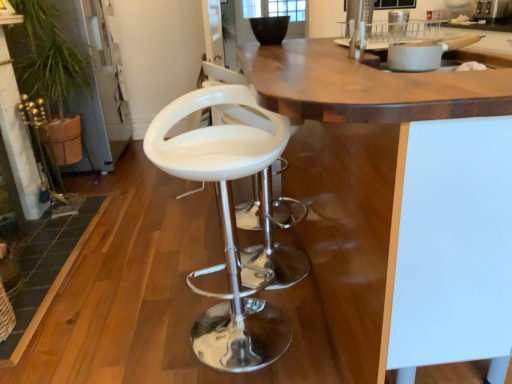
In order to click on white glossy bar stool at center in this screenshot , I will do `click(227, 224)`.

The image size is (512, 384). What do you see at coordinates (227, 224) in the screenshot? I see `white glossy bar stool at center` at bounding box center [227, 224].

In the scene shown: Measure the distance between white ceramic pot at upper right and camera.

The distance of white ceramic pot at upper right from camera is 3.70 feet.

Where is `wooden at center`? The height and width of the screenshot is (384, 512). wooden at center is located at coordinates (396, 169).

Measure the distance between white ceramic pot at upper right and white glossy bar stool at center.

white ceramic pot at upper right is 30.81 inches away from white glossy bar stool at center.

Considering the sizes of objects white ceramic pot at upper right and white glossy bar stool at center in the image provided, who is taller, white ceramic pot at upper right or white glossy bar stool at center?

white glossy bar stool at center.

From a real-world perspective, is white ceramic pot at upper right positioned over white glossy bar stool at center based on gravity?

Yes, from a real-world perspective, white ceramic pot at upper right is above white glossy bar stool at center.

In the image, is white ceramic pot at upper right on the left side or the right side of white glossy bar stool at center?

white ceramic pot at upper right is positioned on white glossy bar stool at center's right side.

Looking at this image, can white glossy bar stool at center be found inside wooden at center?

That's correct, white glossy bar stool at center is inside wooden at center.

Considering the sizes of objects wooden at center and white glossy bar stool at center in the image provided, who is smaller, wooden at center or white glossy bar stool at center?

white glossy bar stool at center.

From the image's perspective, is wooden at center located above or below white glossy bar stool at center?

From the image's perspective, wooden at center appears above white glossy bar stool at center.

Which object is further away from the camera taking this photo, wooden at center or white glossy bar stool at center?

white glossy bar stool at center is further away from the camera.

Can you tell me how much white glossy bar stool at center and wooden at center differ in facing direction?

They differ by 94.2 degrees in their facing directions.

From the image's perspective, which object appears higher, white glossy bar stool at center or wooden at center?

wooden at center.

Which is closer, (281,330) or (490,166)?

Point (490,166)

Which of these two, white glossy bar stool at center or wooden at center, stands taller?

wooden at center is taller.

From the image's perspective, would you say wooden at center is shown under white ceramic pot at upper right?

Yes, from the image's perspective, wooden at center is below white ceramic pot at upper right.

Which of these two, wooden at center or white ceramic pot at upper right, is wider?

wooden at center.

Can you confirm if wooden at center is smaller than white ceramic pot at upper right?

Incorrect, wooden at center is not smaller in size than white ceramic pot at upper right.

In the scene shown: How many degrees apart are the facing directions of white glossy bar stool at center and white ceramic pot at upper right?

white glossy bar stool at center and white ceramic pot at upper right are facing 90 degrees away from each other.

Considering the sizes of objects white glossy bar stool at center and white ceramic pot at upper right in the image provided, who is taller, white glossy bar stool at center or white ceramic pot at upper right?

Standing taller between the two is white glossy bar stool at center.

From the image's perspective, is white glossy bar stool at center on white ceramic pot at upper right?

No, from the image's perspective, white glossy bar stool at center is not above white ceramic pot at upper right.

From a real-world perspective, is white glossy bar stool at center under white ceramic pot at upper right?

Yes, from a real-world perspective, white glossy bar stool at center is beneath white ceramic pot at upper right.

From a real-world perspective, which object rests below the other?

From a 3D spatial view, wooden at center is below.

Between white ceramic pot at upper right and wooden at center, which one has more height?

With more height is wooden at center.

Considering the sizes of objects white ceramic pot at upper right and wooden at center in the image provided, who is bigger, white ceramic pot at upper right or wooden at center?

Bigger between the two is wooden at center.

Can we say white ceramic pot at upper right lies outside wooden at center?

No.

Find the location of a particular element. The width and height of the screenshot is (512, 384). chair in front of the white ceramic pot at upper right is located at coordinates (227, 224).

You are a GUI agent. You are given a task and a screenshot of the screen. Output one action in this format:
    pyautogui.click(x=<x>, y=<y>)
    Task: Click on the countertop that is on the right side of white glossy bar stool at center
    
    Given the screenshot: What is the action you would take?
    pyautogui.click(x=396, y=169)

Estimate the real-world distances between objects in this image. Which object is further from white glossy bar stool at center, wooden at center or white ceramic pot at upper right?

white ceramic pot at upper right.

Based on their spatial positions, is white glossy bar stool at center or wooden at center further from white ceramic pot at upper right?

Among the two, white glossy bar stool at center is located further to white ceramic pot at upper right.

Based on their spatial positions, is white ceramic pot at upper right or white glossy bar stool at center further from wooden at center?

white glossy bar stool at center is positioned further to the anchor wooden at center.

Looking at the image, which one is located closer to white ceramic pot at upper right, wooden at center or white glossy bar stool at center?

wooden at center.

Based on their spatial positions, is white glossy bar stool at center or white ceramic pot at upper right closer to wooden at center?

Based on the image, white ceramic pot at upper right appears to be nearer to wooden at center.

Based on their spatial positions, is white ceramic pot at upper right or wooden at center closer to white glossy bar stool at center?

Based on the image, wooden at center appears to be nearer to white glossy bar stool at center.

Locate an element on the screen. This screenshot has height=384, width=512. countertop located between white glossy bar stool at center and white ceramic pot at upper right in the left-right direction is located at coordinates (396, 169).